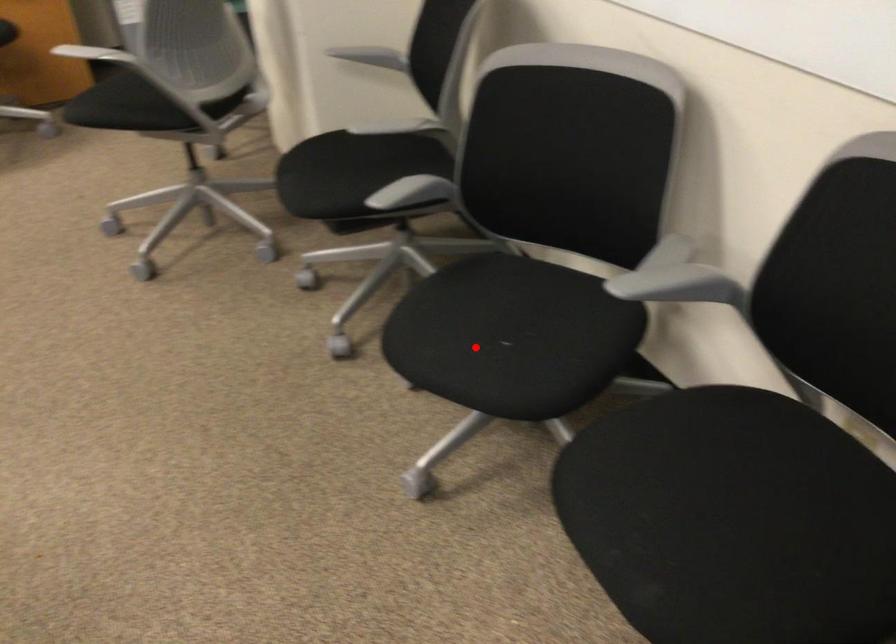
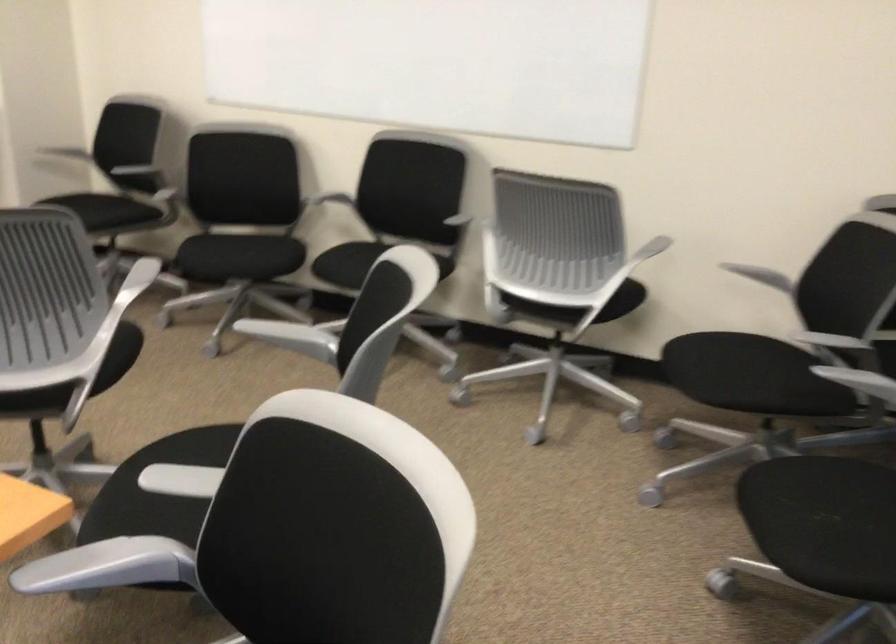
Find the pixel in the second image that matches the highlighted location in the first image.

(237, 257)